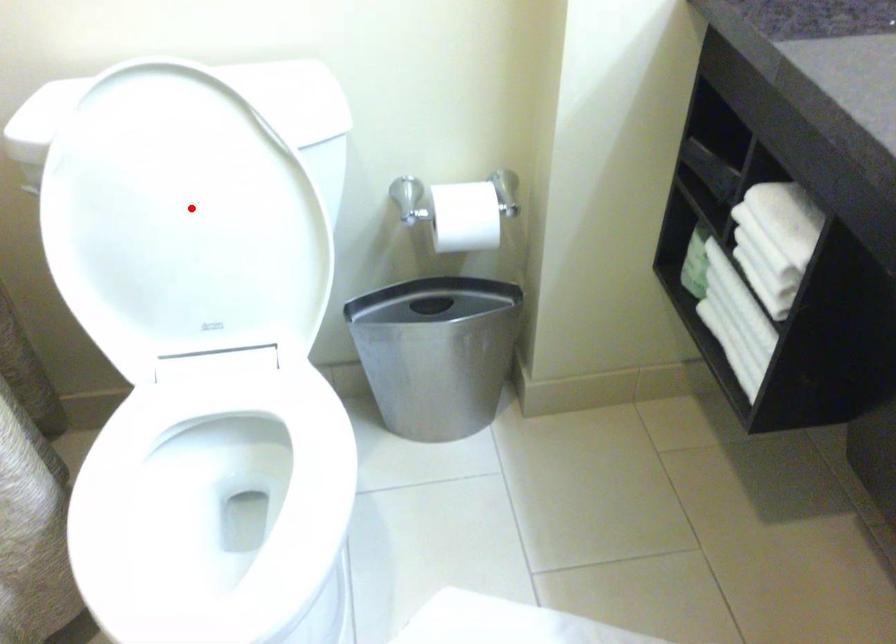
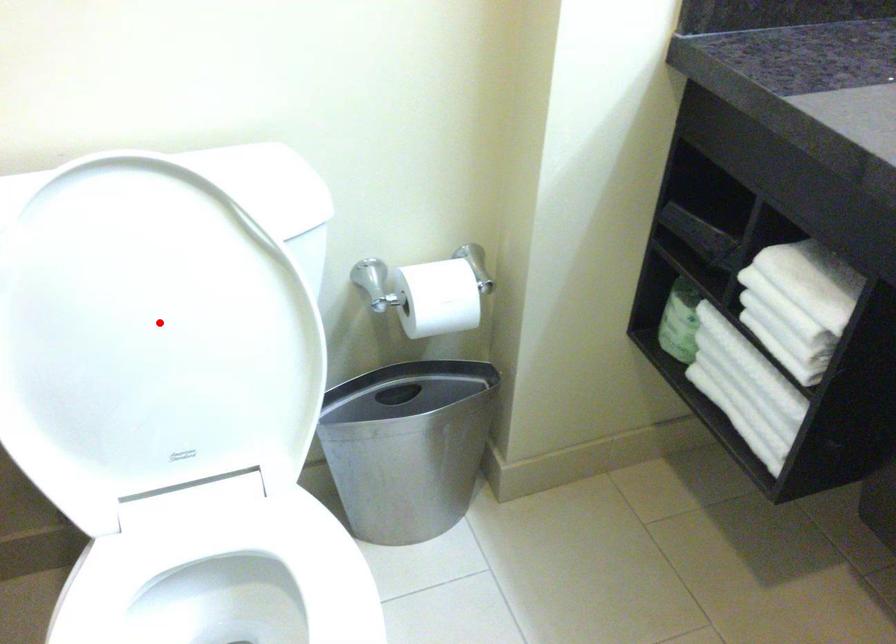
I am providing you with two images of the same scene from different viewpoints. A red point is marked on the first image and another point is marked on the second image. Are the points marked in image1 and image2 representing the same 3D position?

Yes